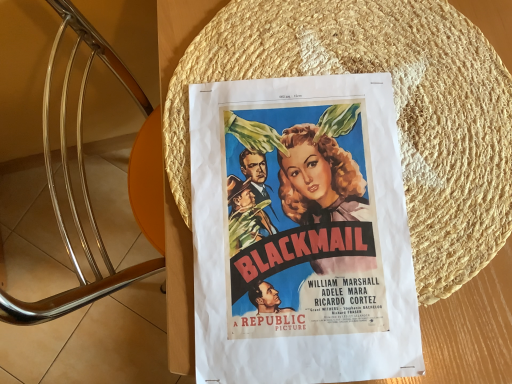
Question: Can you confirm if matte paper poster at center is smaller than woven straw hat at center?

Choices:
 (A) no
 (B) yes

Answer: (B)

Question: From a real-world perspective, does matte paper poster at center stand above woven straw hat at center?

Choices:
 (A) yes
 (B) no

Answer: (A)

Question: Does matte paper poster at center have a lesser width compared to woven straw hat at center?

Choices:
 (A) no
 (B) yes

Answer: (B)

Question: Could you tell me if matte paper poster at center is turned towards woven straw hat at center?

Choices:
 (A) no
 (B) yes

Answer: (B)

Question: Can you confirm if matte paper poster at center is wider than woven straw hat at center?

Choices:
 (A) yes
 (B) no

Answer: (B)

Question: Does matte paper poster at center appear on the left side of woven straw hat at center?

Choices:
 (A) no
 (B) yes

Answer: (B)

Question: Is the depth of woven straw hat at center greater than that of matte paper poster at center?

Choices:
 (A) yes
 (B) no

Answer: (A)

Question: Considering the relative sizes of woven straw hat at center and matte paper poster at center in the image provided, is woven straw hat at center shorter than matte paper poster at center?

Choices:
 (A) no
 (B) yes

Answer: (B)

Question: Can you confirm if woven straw hat at center is wider than matte paper poster at center?

Choices:
 (A) no
 (B) yes

Answer: (B)

Question: Can you confirm if woven straw hat at center is positioned to the right of matte paper poster at center?

Choices:
 (A) yes
 (B) no

Answer: (A)

Question: Can you confirm if woven straw hat at center is positioned to the left of matte paper poster at center?

Choices:
 (A) no
 (B) yes

Answer: (A)

Question: Are woven straw hat at center and matte paper poster at center making contact?

Choices:
 (A) no
 (B) yes

Answer: (B)

Question: From a real-world perspective, is woven straw hat at center above or below matte paper poster at center?

Choices:
 (A) below
 (B) above

Answer: (A)